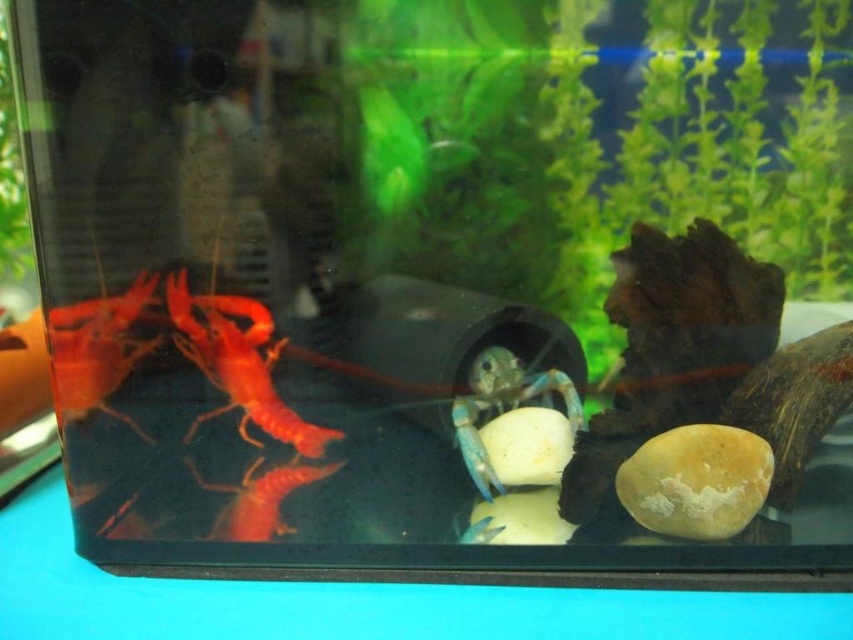
You are an aquatic creature in the aquarium. You want to hide behind the nearest object to you. Which object should you choose between the matte red lobster at center and the blue translucent crab at center?

The matte red lobster at center is closer to the viewer than the blue translucent crab at center, so you should choose the matte red lobster at center to hide behind.

You are a small fish in the aquarium. You see the matte red lobster at center and the matte red shrimp at left. Which one is wider?

The matte red lobster at center is wider than the matte red shrimp at left.